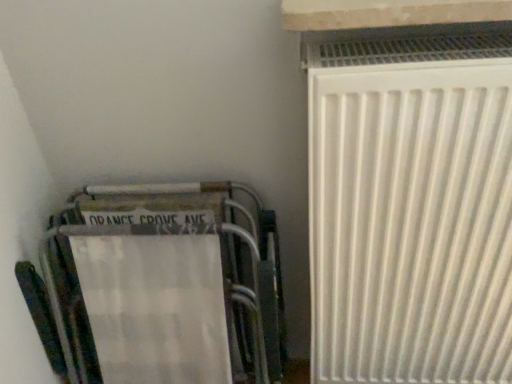
Question: Is metallic silver folding chair at lower left located outside white stone window sill at upper right?

Choices:
 (A) yes
 (B) no

Answer: (A)

Question: Is metallic silver folding chair at lower left smaller than white stone window sill at upper right?

Choices:
 (A) yes
 (B) no

Answer: (B)

Question: Is metallic silver folding chair at lower left next to white stone window sill at upper right?

Choices:
 (A) no
 (B) yes

Answer: (A)

Question: Considering the relative sizes of metallic silver folding chair at lower left and white stone window sill at upper right in the image provided, is metallic silver folding chair at lower left shorter than white stone window sill at upper right?

Choices:
 (A) yes
 (B) no

Answer: (B)

Question: Considering the relative positions of metallic silver folding chair at lower left and white stone window sill at upper right in the image provided, is metallic silver folding chair at lower left behind white stone window sill at upper right?

Choices:
 (A) no
 (B) yes

Answer: (B)

Question: From their relative heights in the image, would you say white matte radiator at right is taller or shorter than metallic silver folding chair at lower left?

Choices:
 (A) short
 (B) tall

Answer: (B)

Question: From the image's perspective, relative to metallic silver folding chair at lower left, is white matte radiator at right above or below?

Choices:
 (A) below
 (B) above

Answer: (B)

Question: Is white matte radiator at right situated inside metallic silver folding chair at lower left or outside?

Choices:
 (A) outside
 (B) inside

Answer: (A)

Question: Considering the positions of white matte radiator at right and metallic silver folding chair at lower left in the image, is white matte radiator at right bigger or smaller than metallic silver folding chair at lower left?

Choices:
 (A) small
 (B) big

Answer: (B)

Question: From the image's perspective, relative to metallic silver folding chair at lower left, is white stone window sill at upper right above or below?

Choices:
 (A) above
 (B) below

Answer: (A)

Question: Looking at the image, does white stone window sill at upper right seem bigger or smaller compared to metallic silver folding chair at lower left?

Choices:
 (A) big
 (B) small

Answer: (B)

Question: Is white stone window sill at upper right wider or thinner than metallic silver folding chair at lower left?

Choices:
 (A) thin
 (B) wide

Answer: (B)

Question: Choose the correct answer: Is white stone window sill at upper right inside metallic silver folding chair at lower left or outside it?

Choices:
 (A) outside
 (B) inside

Answer: (A)

Question: Is white matte radiator at right in front of or behind white stone window sill at upper right in the image?

Choices:
 (A) front
 (B) behind

Answer: (B)

Question: From a real-world perspective, is white matte radiator at right positioned above or below white stone window sill at upper right?

Choices:
 (A) above
 (B) below

Answer: (B)